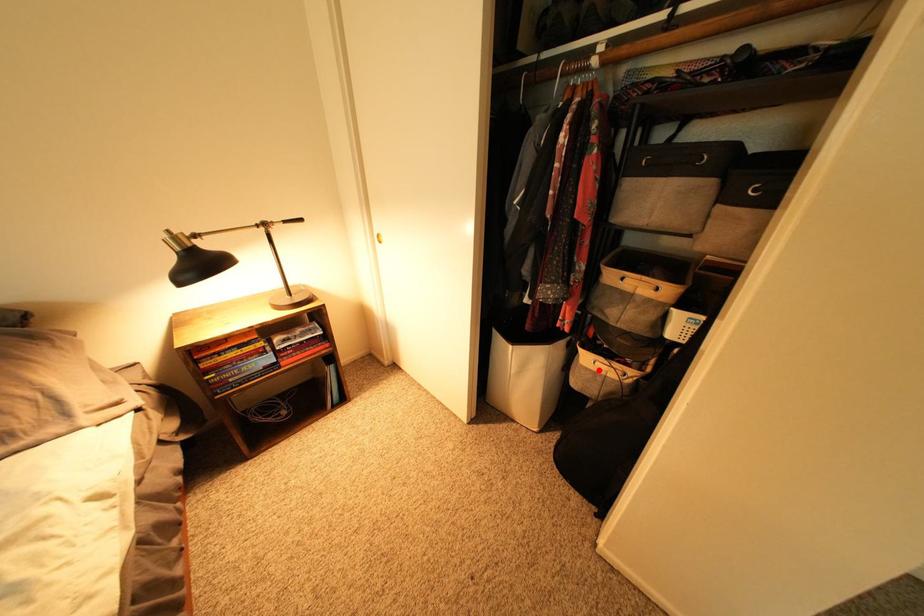
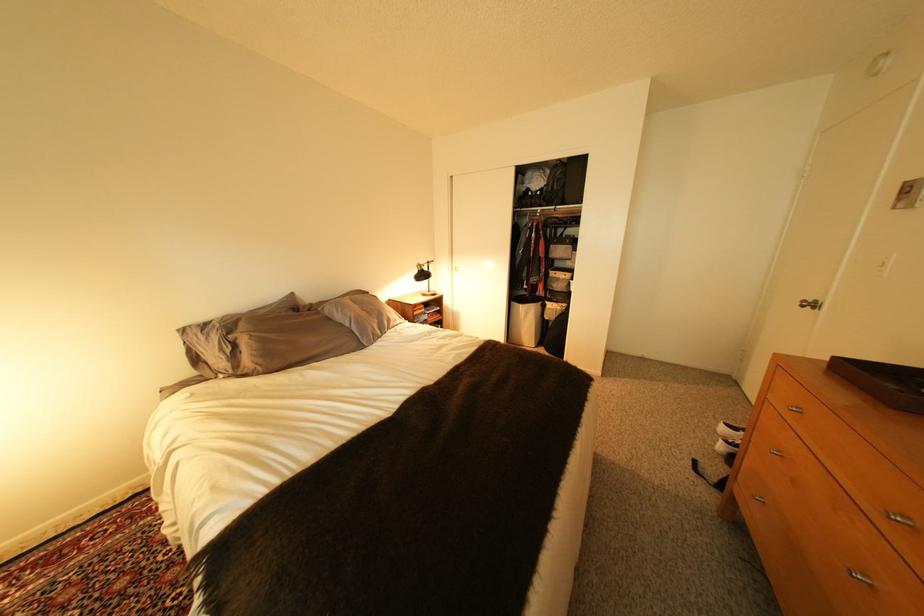
Question: I am providing you with two images of the same scene from different viewpoints. Given a red point in image1, look at the same physical point in image2. Is it:

Choices:
 (A) Closer to the viewpoint
 (B) Farther from the viewpoint

Answer: (A)